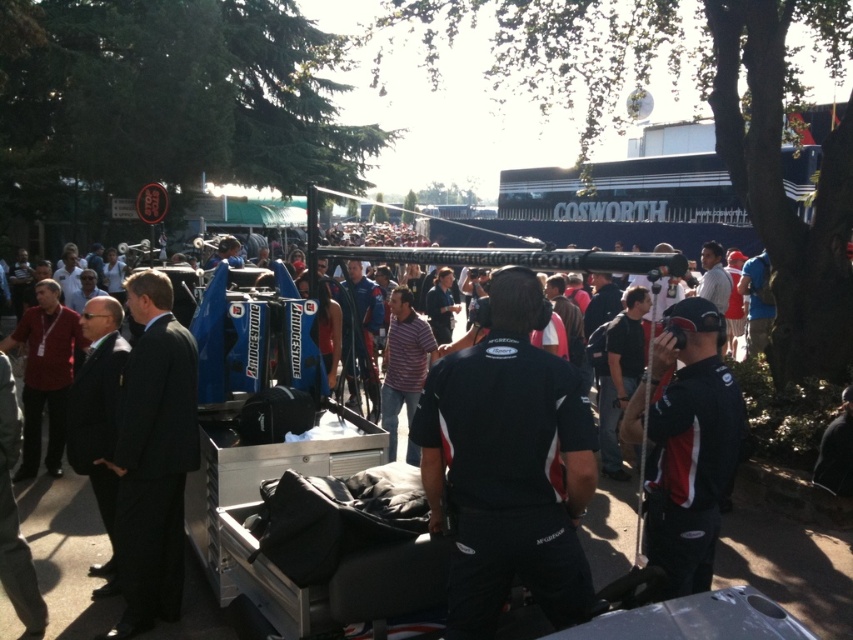
Is point (485, 481) closer to viewer compared to point (181, 502)?

That is True.

Which is behind, point (526, 579) or point (186, 410)?

Point (186, 410)

Which is in front, point (503, 492) or point (120, 502)?

Point (503, 492) is more forward.

Where is `black fabric shirt at center`? black fabric shirt at center is located at coordinates (508, 467).

Is point (177, 465) closer to viewer compared to point (711, 538)?

No, it is behind (711, 538).

Which is in front, point (192, 340) or point (654, 339)?

Point (654, 339) is in front.

Locate an element on the screen. dark suit at center is located at coordinates [x=154, y=458].

Is black fabric shirt at center shorter than black fabric jacket at center?

In fact, black fabric shirt at center may be taller than black fabric jacket at center.

Who is shorter, black fabric shirt at center or black fabric jacket at center?

With less height is black fabric jacket at center.

Measure the distance between point (425, 403) and camera.

The distance of point (425, 403) from camera is 8.92 feet.

The width and height of the screenshot is (853, 640). Find the location of `black fabric shirt at center`. black fabric shirt at center is located at coordinates (508, 467).